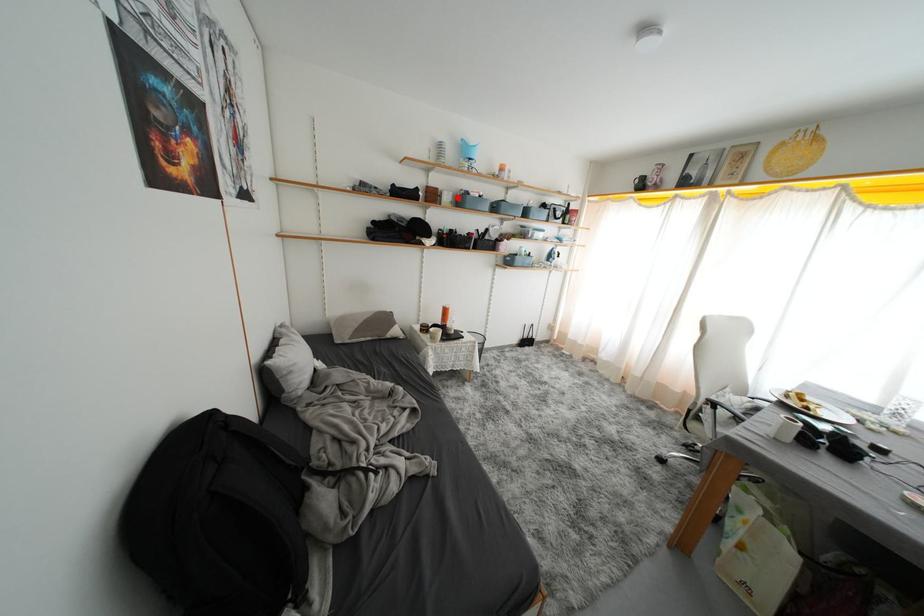
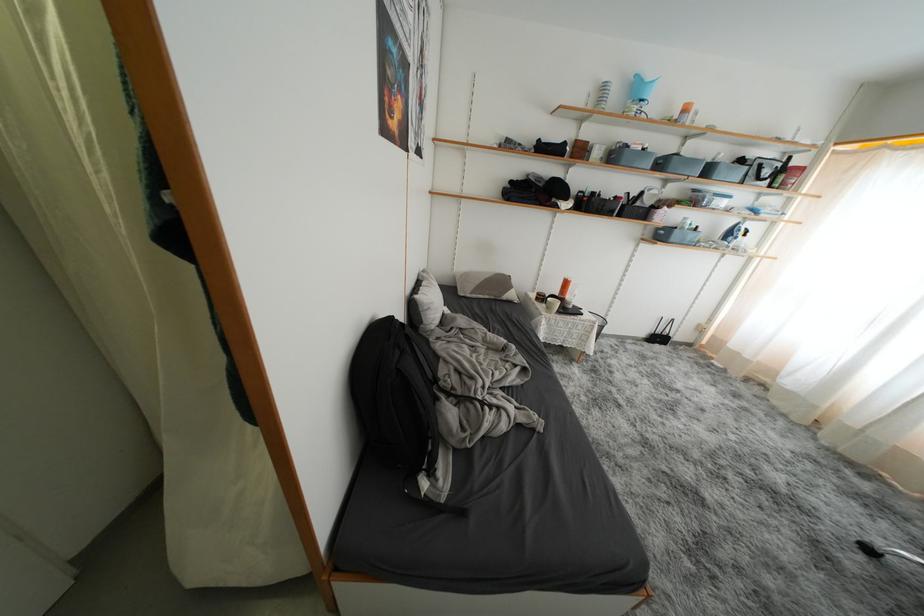
Where in the second image is the point corresponding to the highlighted location from the first image?

(610, 152)